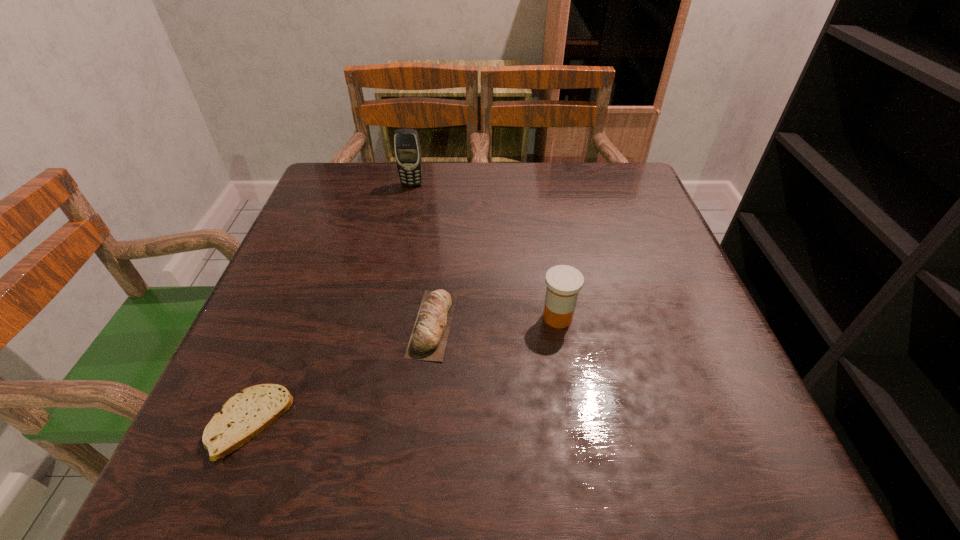
Locate an element on the screen. The height and width of the screenshot is (540, 960). cellular telephone is located at coordinates (407, 149).

Find the location of a particular element. the third object from right to left is located at coordinates (407, 149).

You are a GUI agent. You are given a task and a screenshot of the screen. Output one action in this format:
    pyautogui.click(x=<x>, y=<y>)
    Task: Click on the third shortest object
    
    Given the screenshot: What is the action you would take?
    pyautogui.click(x=564, y=282)

At what (x,y) coordinates should I click in order to perform the action: click on the rightmost object. Please return your answer as a coordinate pair (x, y). This screenshot has height=540, width=960. Looking at the image, I should click on click(564, 282).

The height and width of the screenshot is (540, 960). What are the coordinates of `the farther pita bread` in the screenshot? It's located at (428, 340).

What are the coordinates of `the taller pita bread` in the screenshot? It's located at (428, 340).

I want to click on the nearest object, so click(245, 415).

Where is `the shorter pita bread`? the shorter pita bread is located at coordinates (245, 415).

Where is `free space located 0.070m on the front face of the second object from left to right`? The height and width of the screenshot is (540, 960). free space located 0.070m on the front face of the second object from left to right is located at coordinates (408, 203).

Where is `vacant space positioned on the label of the medicine`? vacant space positioned on the label of the medicine is located at coordinates (412, 317).